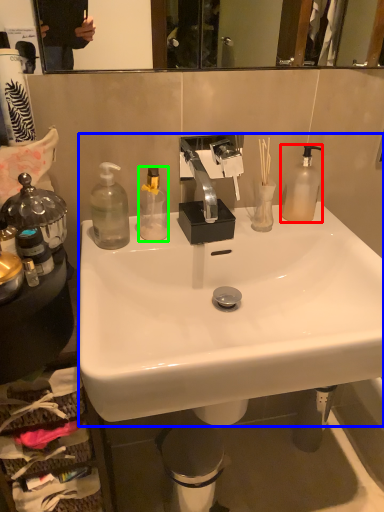
Question: Which object is positioned closest to bottle (highlighted by a red box)? Select from sink (highlighted by a blue box) and bottle (highlighted by a green box).

Choices:
 (A) sink
 (B) bottle

Answer: (A)